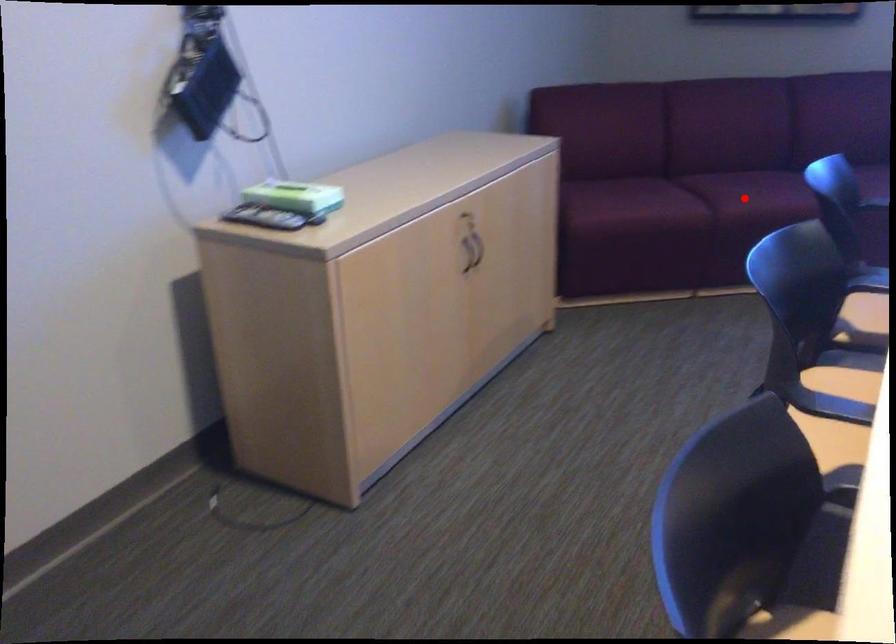
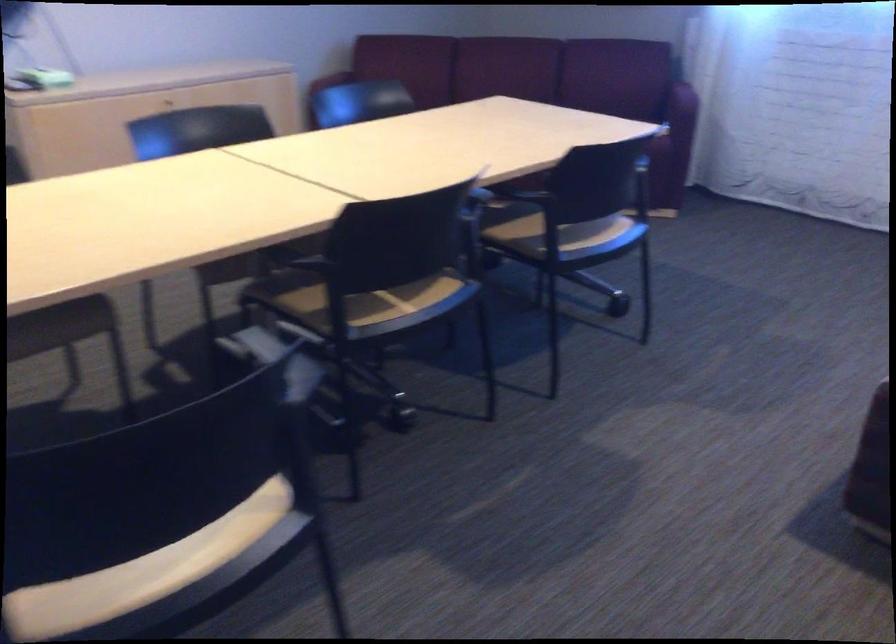
Question: I am providing you with two images of the same scene from different viewpoints. A red point is marked on the first image. At the location where the point appears in image 1, is it still visible in image 2?

Choices:
 (A) Yes
 (B) No

Answer: (B)